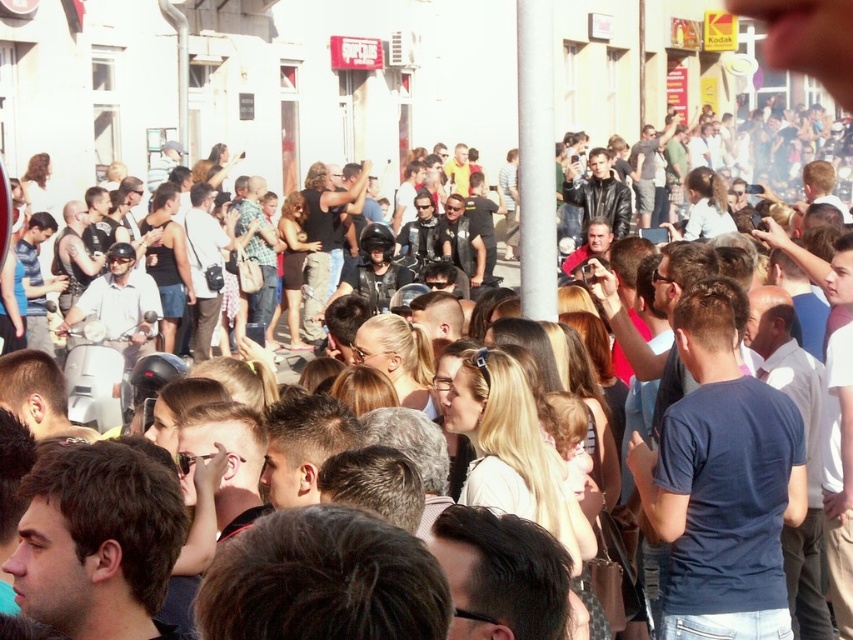
You are standing at the point marked by the pole in the foreground of the urban street scene. A friend is standing at the point labeled point (704, 458). How far apart are you and your friend?

The distance between you and your friend at point (704, 458) is 41.92 meters.

You are standing at the point with coordinates point (544, 280) and want to move towards the point with coordinates point (785, 621). Given the crowded street scene, can you walk directly to your destination without needing to go around obstacles?

Yes, you can walk directly to point (785, 621) from point (544, 280) because point (785, 621) is in front of point (544, 280), indicating a clear path between them.